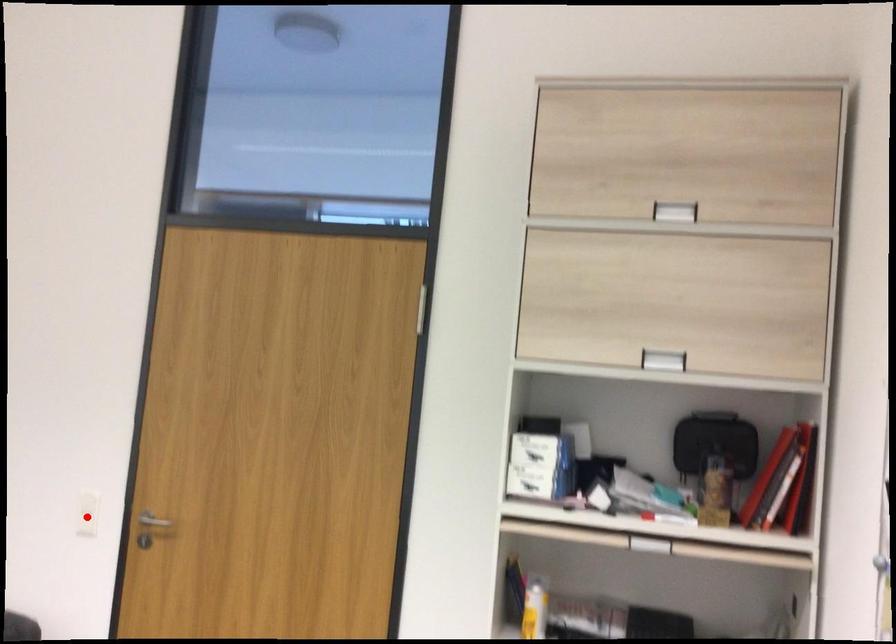
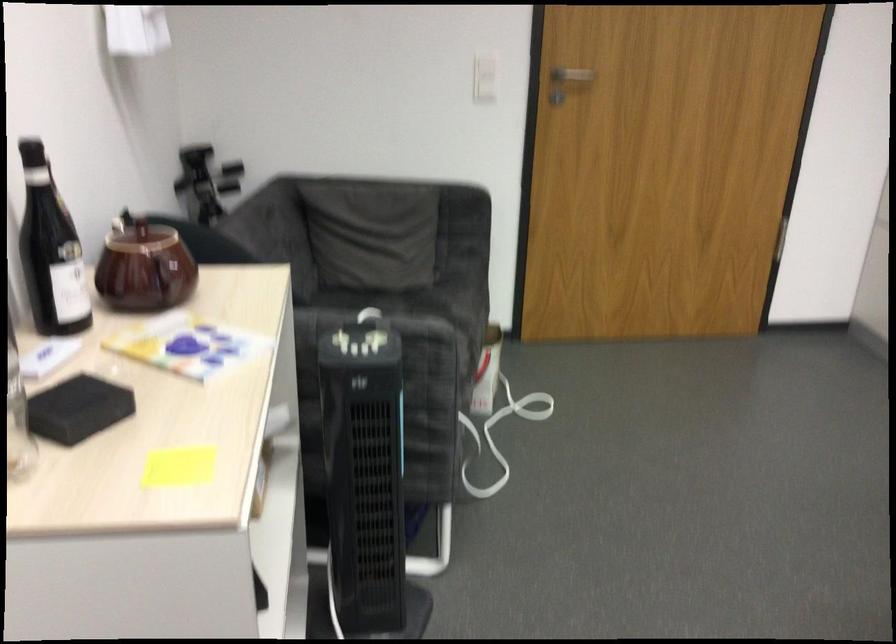
Find the pixel in the second image that matches the highlighted location in the first image.

(484, 77)